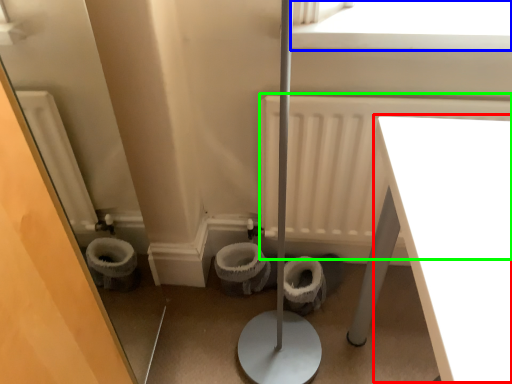
Question: Estimate the real-world distances between objects in this image. Which object is farther from table (highlighted by a red box), window screen (highlighted by a blue box) or radiator (highlighted by a green box)?

Choices:
 (A) window screen
 (B) radiator

Answer: (B)